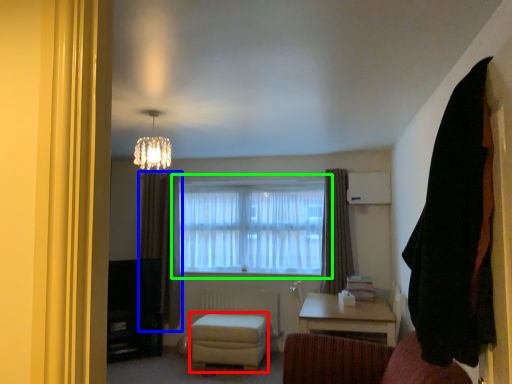
Question: Which object is positioned farthest from stool (highlighted by a red box)? Select from curtain (highlighted by a blue box) and window (highlighted by a green box).

Choices:
 (A) curtain
 (B) window

Answer: (B)